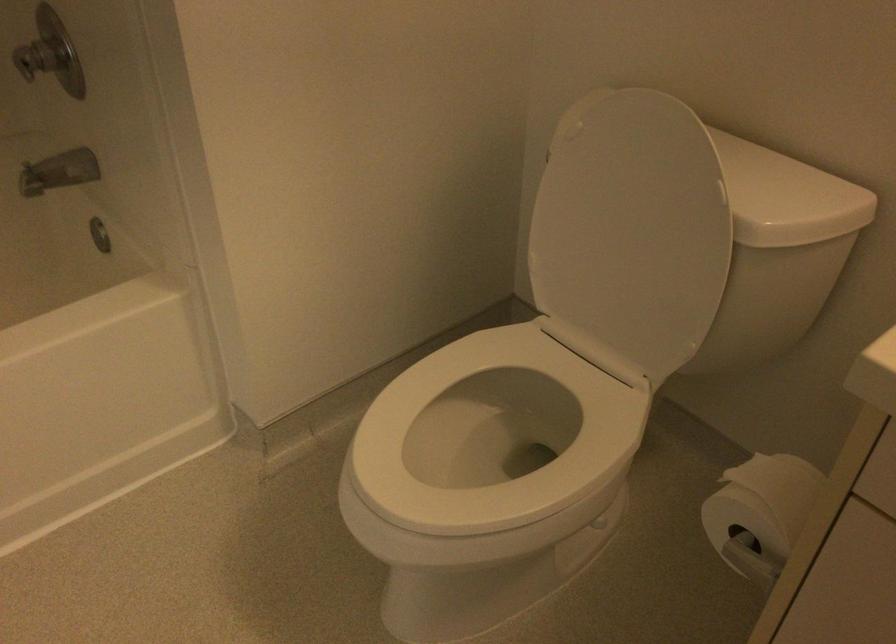
The width and height of the screenshot is (896, 644). I want to click on metal shower knob, so click(50, 53).